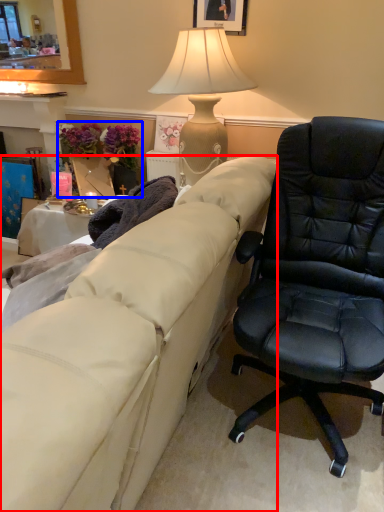
Question: Among these objects, which one is farthest to the camera, studio couch (highlighted by a red box) or houseplant (highlighted by a blue box)?

Choices:
 (A) studio couch
 (B) houseplant

Answer: (B)